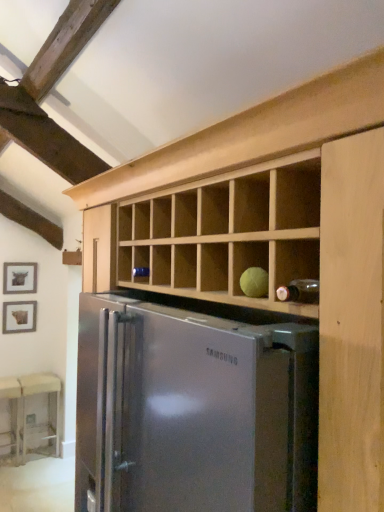
Find the location of `vacant area on top of wooden table at lower left, positioned as the 2th table in right-to-left order (from a real-world perspective)`. vacant area on top of wooden table at lower left, positioned as the 2th table in right-to-left order (from a real-world perspective) is located at coordinates (8, 382).